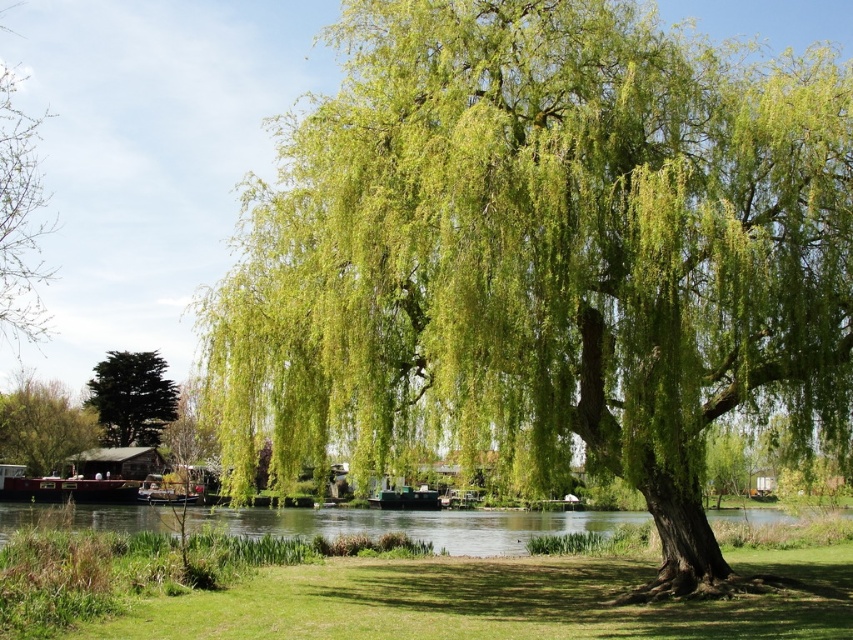
Question: Is green leafy willow at center thinner than green leafy tree at center?

Choices:
 (A) no
 (B) yes

Answer: (A)

Question: Is green leafy willow at center above green leafy tree at center?

Choices:
 (A) yes
 (B) no

Answer: (A)

Question: Can you confirm if green leafy willow at center is positioned below green leafy tree at center?

Choices:
 (A) no
 (B) yes

Answer: (A)

Question: Among these points, which one is farthest from the camera?

Choices:
 (A) (67, 424)
 (B) (102, 396)
 (C) (97, 524)

Answer: (B)

Question: Which point is closer to the camera taking this photo?

Choices:
 (A) (129, 413)
 (B) (4, 268)

Answer: (B)

Question: Which of the following is the closest to the observer?

Choices:
 (A) green leafy tree at center
 (B) green matte tree at left

Answer: (A)